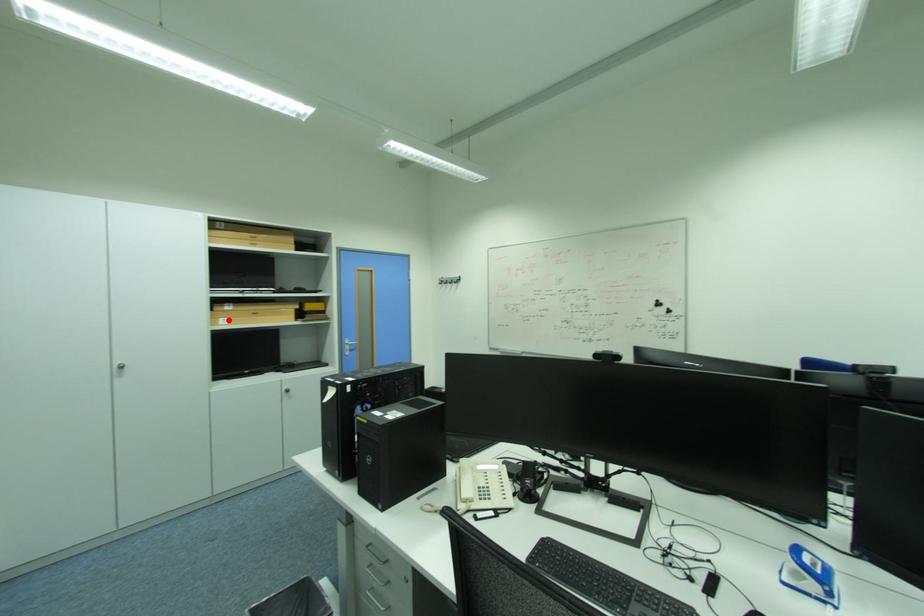
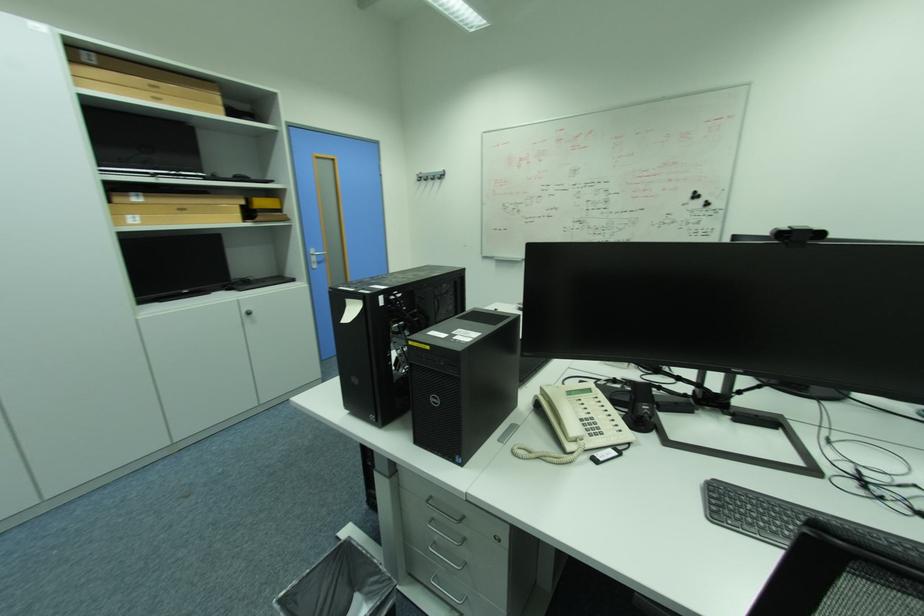
Locate, in the second image, the point that corresponds to the highlighted location in the first image.

(136, 217)